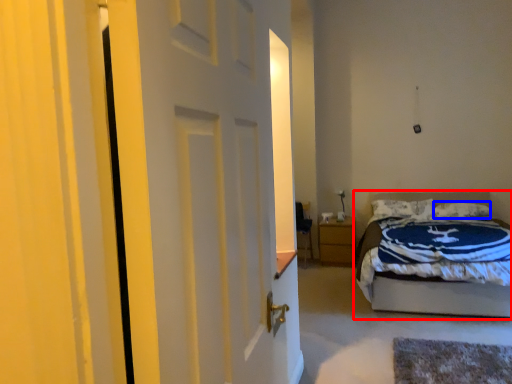
Question: Among these objects, which one is farthest to the camera, bed (highlighted by a red box) or pillow (highlighted by a blue box)?

Choices:
 (A) bed
 (B) pillow

Answer: (B)